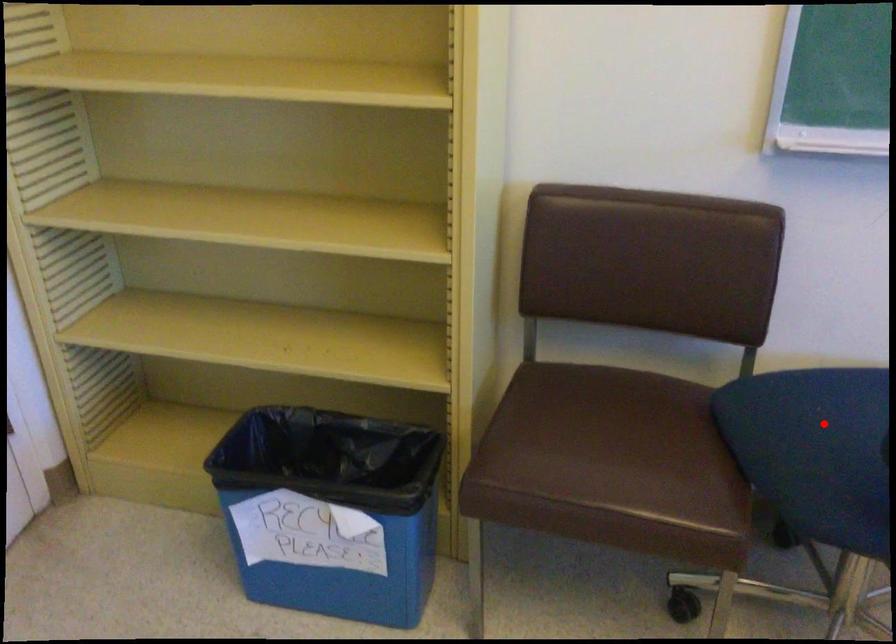
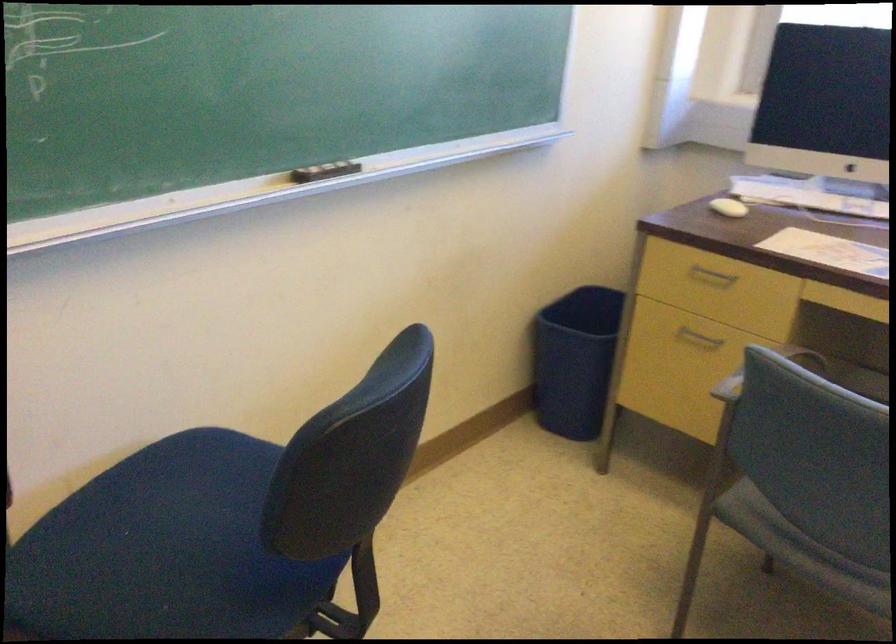
Question: I am providing you with two images of the same scene from different viewpoints. In image1, a red point is highlighted. Considering the same 3D point in image2, which of the following is correct?

Choices:
 (A) It is closer
 (B) It is farther

Answer: (A)